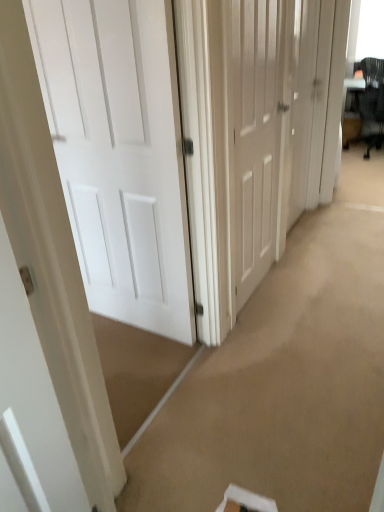
Question: Is white matte door at center, which ranks as the 3th door in left-to-right order, to the left or to the right of white matte door at center, the second door when ordered from left to right, in the image?

Choices:
 (A) right
 (B) left

Answer: (A)

Question: Is point (309, 47) positioned closer to the camera than point (286, 60)?

Choices:
 (A) farther
 (B) closer

Answer: (A)

Question: Which is farther from the black mesh swivel chair at upper right?

Choices:
 (A) white matte door at center, the first door positioned from the right
 (B) white matte door at center, positioned as the third door in right-to-left order
 (C) white matte door at center, the second door when ordered from left to right

Answer: (B)

Question: Which object is the farthest from the white matte door at center, the first door when ordered from left to right?

Choices:
 (A) black mesh swivel chair at upper right
 (B) white matte door at center, which ranks as the 3th door in left-to-right order
 (C) white matte door at center, which ranks as the 2th door in right-to-left order

Answer: (A)